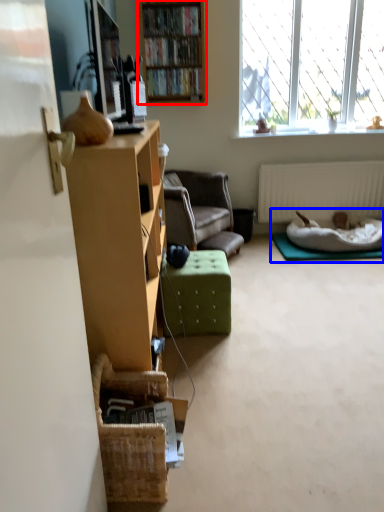
Question: Which of the following is the farthest to the observer, bookcase (highlighted by a red box) or bed (highlighted by a blue box)?

Choices:
 (A) bookcase
 (B) bed

Answer: (B)